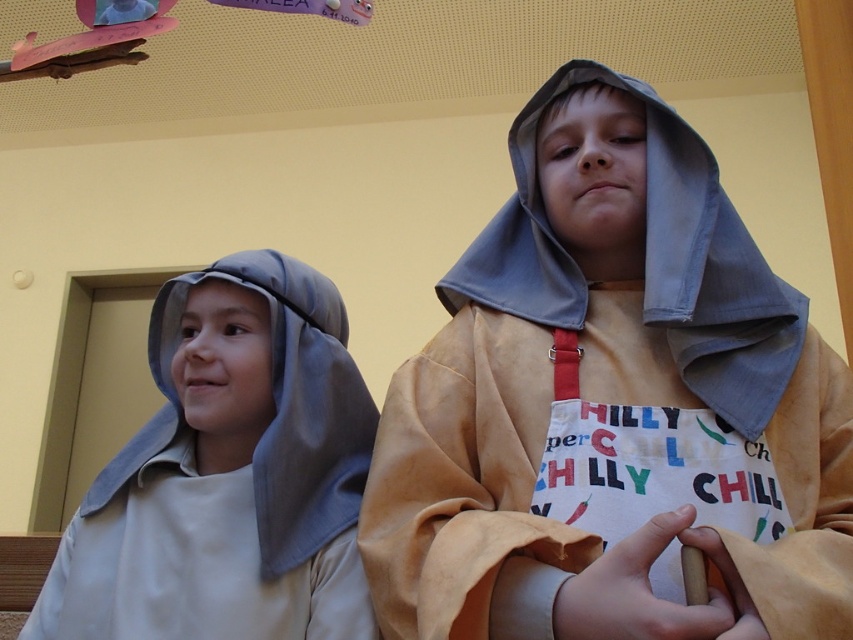
Is light brown leather robe at center further to camera compared to matte gray hood at left?

No, light brown leather robe at center is in front of matte gray hood at left.

How distant is light brown leather robe at center from matte gray hood at left?

15.74 inches

The image size is (853, 640). In order to click on light brown leather robe at center in this screenshot , I will do `click(612, 406)`.